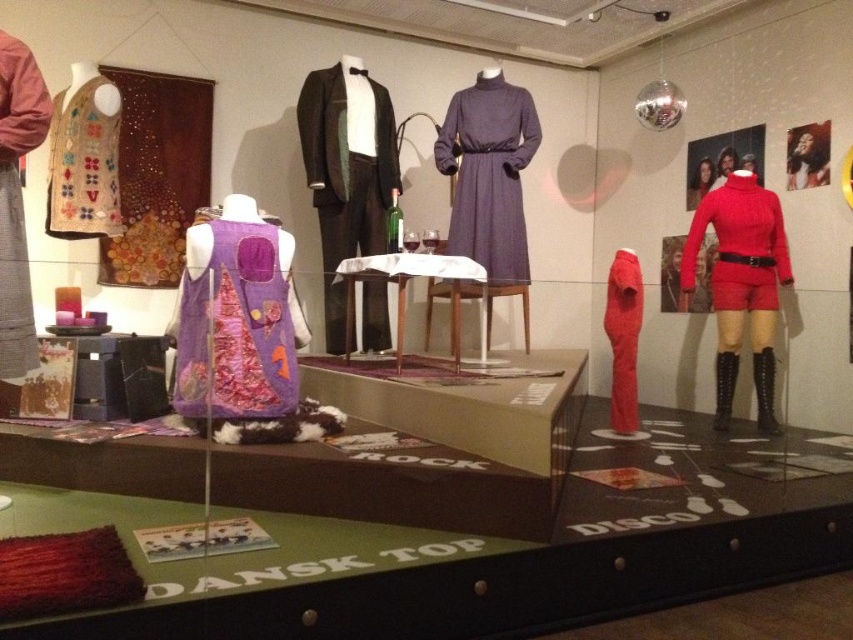
You are a visitor standing in front of the display case. You want to take a photo of the shiny black tuxedo at center and the knitted beige vest at upper left. Which object should you focus on first to ensure both are in the frame?

You should focus on the knitted beige vest at upper left first because the shiny black tuxedo at center is positioned under it, so adjusting the camera angle to include the vest will naturally include the tuxedo below.

You are a museum visitor standing in front of the display case. You notice the knitted beige vest at upper left and the matte red jumpsuit at right. Which item is placed higher in the display?

The knitted beige vest at upper left is positioned over the matte red jumpsuit at right, meaning it is placed higher in the display.